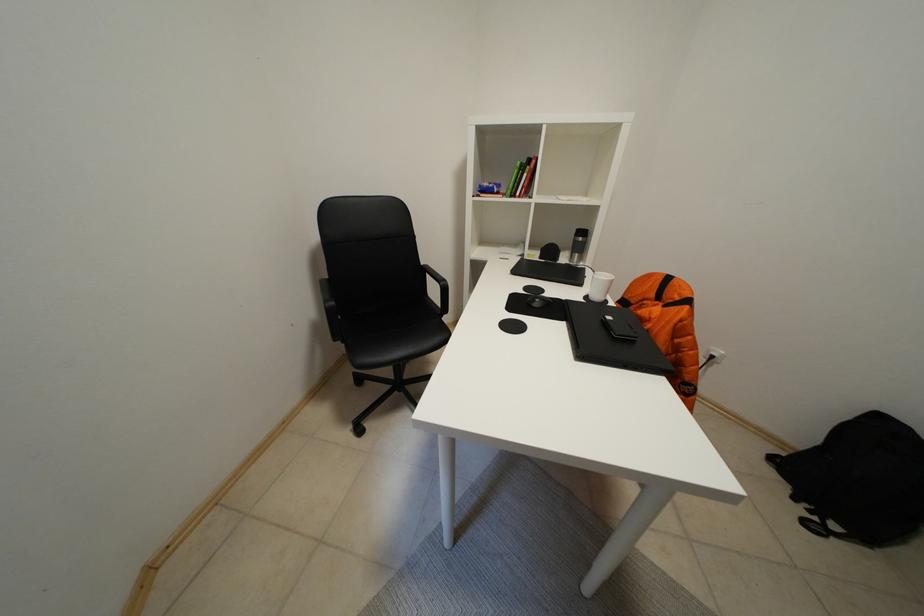
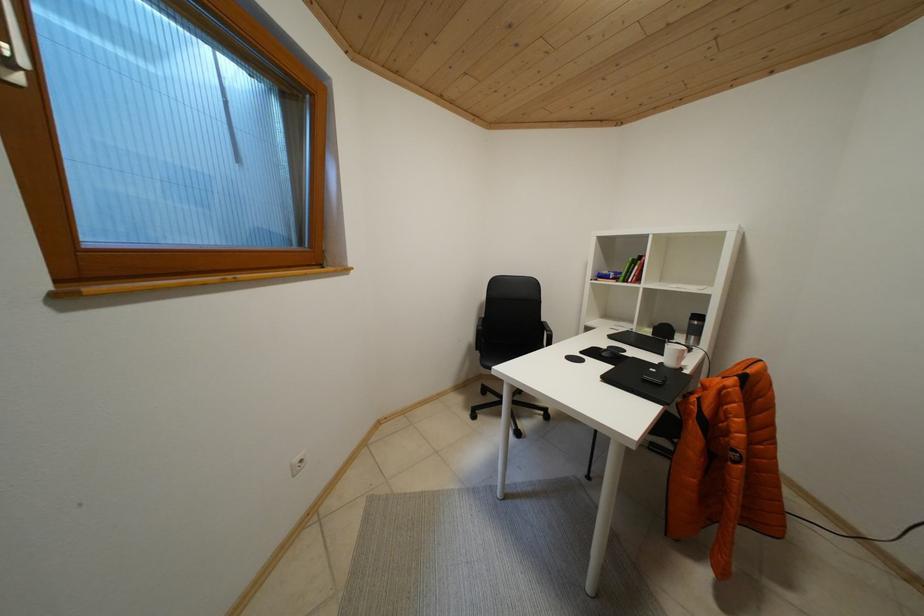
Question: Based on the continuous images, in which direction is the camera rotating? Reply with the corresponding letter.

Choices:
 (A) Left
 (B) Right
 (C) Up
 (D) Down

Answer: (A)